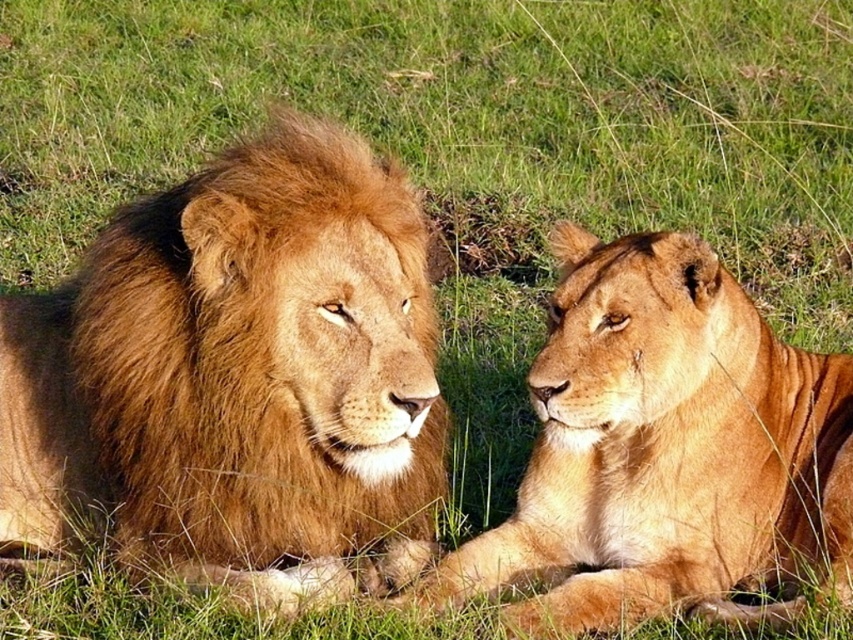
Question: Does golden fur lion at left have a greater width compared to golden fur lion at center?

Choices:
 (A) yes
 (B) no

Answer: (A)

Question: Which point appears closest to the camera in this image?

Choices:
 (A) (819, 456)
 (B) (213, 433)

Answer: (B)

Question: Can you confirm if golden fur lion at left is positioned below golden fur lion at center?

Choices:
 (A) yes
 (B) no

Answer: (B)

Question: Which point is closer to the camera?

Choices:
 (A) (74, 468)
 (B) (631, 280)

Answer: (B)

Question: Is golden fur lion at left further to the viewer compared to golden fur lion at center?

Choices:
 (A) yes
 (B) no

Answer: (B)